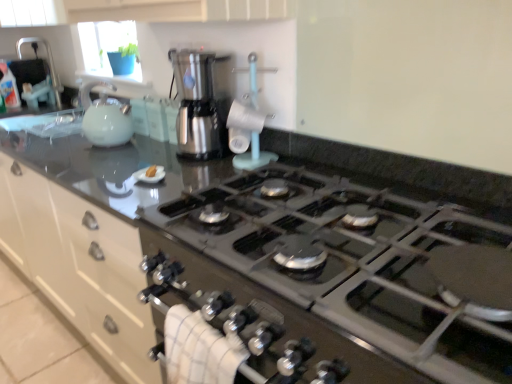
Question: Is yellow sponge at center facing towards black glass stove at center?

Choices:
 (A) no
 (B) yes

Answer: (A)

Question: Can you confirm if yellow sponge at center is thinner than black glass stove at center?

Choices:
 (A) yes
 (B) no

Answer: (A)

Question: Is yellow sponge at center facing away from black glass stove at center?

Choices:
 (A) no
 (B) yes

Answer: (A)

Question: From the image's perspective, is yellow sponge at center located above black glass stove at center?

Choices:
 (A) yes
 (B) no

Answer: (A)

Question: Is yellow sponge at center positioned before black glass stove at center?

Choices:
 (A) no
 (B) yes

Answer: (A)

Question: Based on their positions, is stainless steel coffee maker at center, which ranks as the 1th kitchen appliance in right-to-left order, located to the left or right of black glass stove at center?

Choices:
 (A) right
 (B) left

Answer: (B)

Question: In terms of size, does stainless steel coffee maker at center, arranged as the second kitchen appliance when viewed from the left, appear bigger or smaller than black glass stove at center?

Choices:
 (A) big
 (B) small

Answer: (B)

Question: Looking at their shapes, would you say stainless steel coffee maker at center, arranged as the second kitchen appliance when viewed from the left, is wider or thinner than black glass stove at center?

Choices:
 (A) wide
 (B) thin

Answer: (B)

Question: From the image's perspective, is stainless steel coffee maker at center, which ranks as the 1th kitchen appliance in right-to-left order, positioned above or below black glass stove at center?

Choices:
 (A) above
 (B) below

Answer: (A)

Question: Based on their sizes in the image, would you say white glossy cabinet at upper center is bigger or smaller than brushed metal sink at upper left?

Choices:
 (A) big
 (B) small

Answer: (B)

Question: From the image's perspective, is white glossy cabinet at upper center located above or below brushed metal sink at upper left?

Choices:
 (A) below
 (B) above

Answer: (A)

Question: From a real-world perspective, is white glossy cabinet at upper center positioned above or below brushed metal sink at upper left?

Choices:
 (A) above
 (B) below

Answer: (B)

Question: Is white glossy cabinet at upper center spatially inside brushed metal sink at upper left, or outside of it?

Choices:
 (A) outside
 (B) inside

Answer: (A)

Question: Is brushed metal sink at upper left inside or outside of black glass stove at center?

Choices:
 (A) inside
 (B) outside

Answer: (B)

Question: From the image's perspective, is brushed metal sink at upper left located above or below black glass stove at center?

Choices:
 (A) above
 (B) below

Answer: (A)